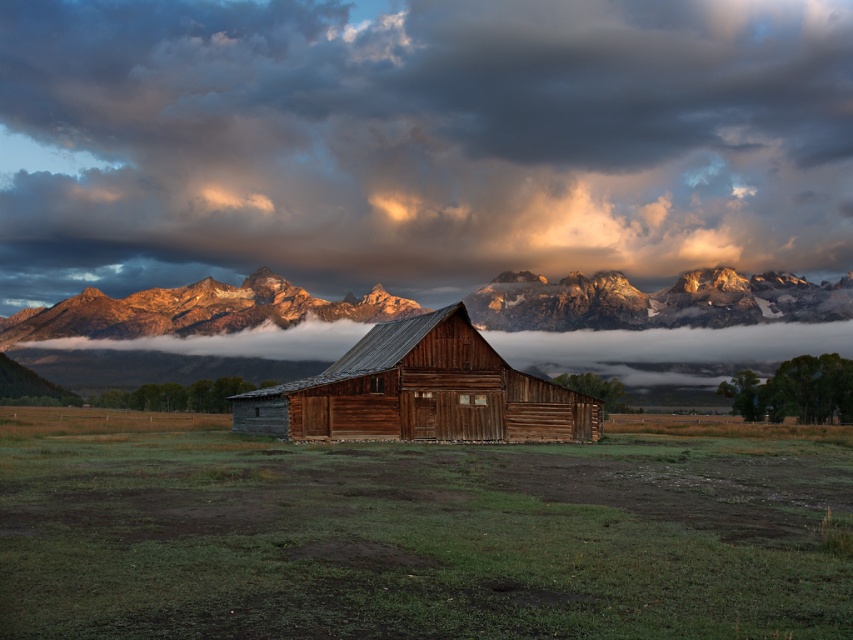
Does rugged stone mountains at upper center lie behind wooden barn at center?

Yes, rugged stone mountains at upper center is further from the viewer.

Based on the photo, can you confirm if rugged stone mountains at upper center is taller than wooden barn at center?

Indeed, rugged stone mountains at upper center has a greater height compared to wooden barn at center.

Who is more distant from viewer, (x=199, y=336) or (x=444, y=332)?

Positioned behind is point (x=199, y=336).

Identify the location of rugged stone mountains at upper center. Image resolution: width=853 pixels, height=640 pixels. (662, 323).

Locate an element on the screen. Image resolution: width=853 pixels, height=640 pixels. cloudy sky at upper center is located at coordinates (418, 141).

Is point (436, 35) positioned after point (380, 339)?

Yes, point (436, 35) is farther from viewer.

I want to click on cloudy sky at upper center, so click(418, 141).

Is point (297, 524) positioned after point (229, 307)?

No, (297, 524) is closer to viewer.

The width and height of the screenshot is (853, 640). I want to click on green grassy field at center, so click(412, 534).